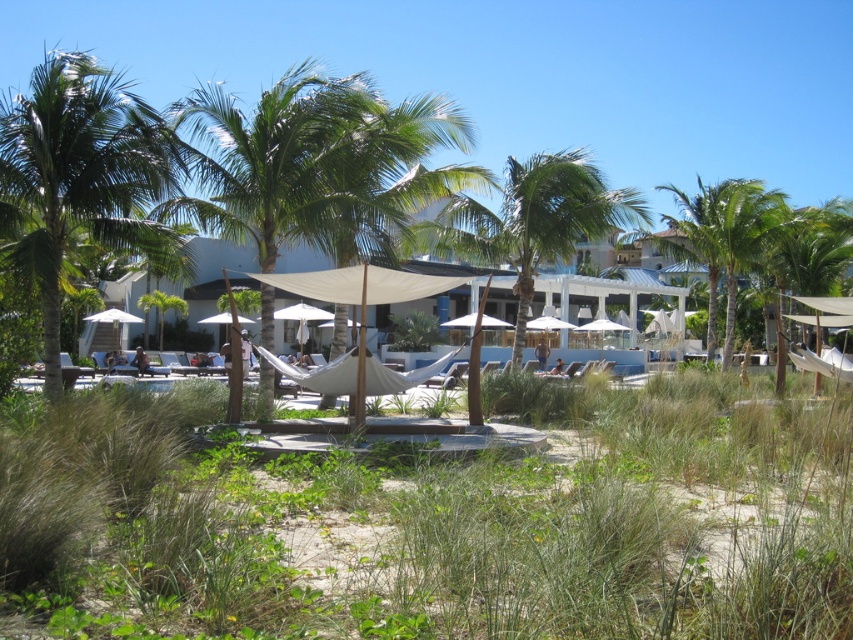
Question: Which object is farther from the camera taking this photo?

Choices:
 (A) green leafy palm tree at center-right
 (B) green leafy palm tree at center
 (C) green leafy palm tree at left

Answer: (A)

Question: Can you confirm if green leafy palm tree at left is positioned below green leafy palm tree at center-right?

Choices:
 (A) no
 (B) yes

Answer: (A)

Question: Which point appears farthest from the camera in this image?

Choices:
 (A) (115, 109)
 (B) (692, 259)

Answer: (B)

Question: Which point is farther to the camera?

Choices:
 (A) green leafy palm tree at center
 (B) green leafy palm tree at left

Answer: (A)

Question: Can you confirm if green leafy palm tree at left is positioned to the left of green leafy palm tree at center-right?

Choices:
 (A) yes
 (B) no

Answer: (A)

Question: Does green leafy palm tree at center appear on the right side of green leafy palm tree at center-right?

Choices:
 (A) yes
 (B) no

Answer: (B)